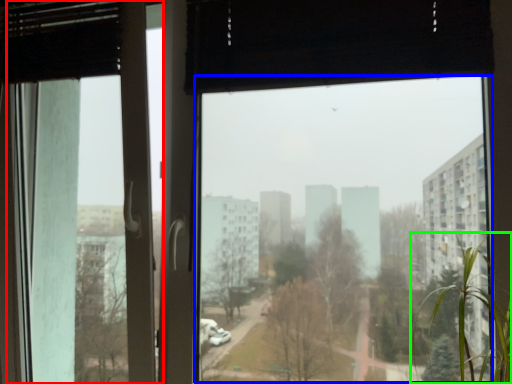
Question: Which is nearer to the screen door (highlighted by a red box)? window screen (highlighted by a blue box) or tree (highlighted by a green box).

Choices:
 (A) window screen
 (B) tree

Answer: (B)